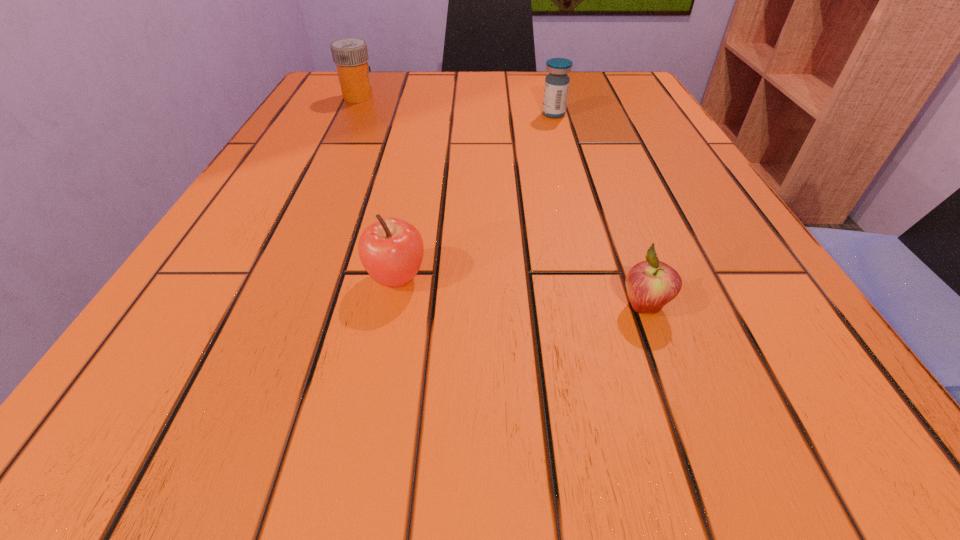
Where is `vacant region between the right apple and the third nearest object`? vacant region between the right apple and the third nearest object is located at coordinates (599, 210).

The height and width of the screenshot is (540, 960). Find the location of `unoccupied position between the right apple and the farthest object`. unoccupied position between the right apple and the farthest object is located at coordinates (501, 201).

You are a GUI agent. You are given a task and a screenshot of the screen. Output one action in this format:
    pyautogui.click(x=<x>, y=<y>)
    Task: Click on the free space between the right medicine and the farthest object
    The width and height of the screenshot is (960, 540).
    Given the screenshot: What is the action you would take?
    pyautogui.click(x=456, y=105)

The image size is (960, 540). I want to click on free spot between the farther medicine and the right apple, so click(501, 201).

The image size is (960, 540). Find the location of `free space between the third nearest object and the left apple`. free space between the third nearest object and the left apple is located at coordinates (475, 196).

Where is `unoccupied position between the farther medicine and the second farthest object`? This screenshot has width=960, height=540. unoccupied position between the farther medicine and the second farthest object is located at coordinates (456, 105).

Locate an element on the screen. free space that is in between the left apple and the second farthest object is located at coordinates (475, 196).

Identify the location of vacant region between the second object from left to right and the nearer medicine. The image size is (960, 540). (475, 196).

Where is `free space between the second object from left to right and the leftmost object`? The height and width of the screenshot is (540, 960). free space between the second object from left to right and the leftmost object is located at coordinates (377, 187).

This screenshot has height=540, width=960. I want to click on vacant space that's between the right apple and the farthest object, so (501, 201).